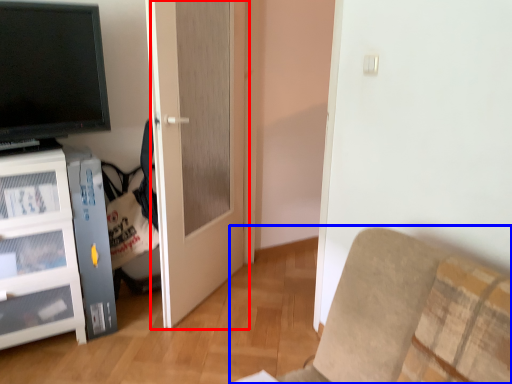
Question: Which object appears farthest to the camera in this image, door (highlighted by a red box) or furniture (highlighted by a blue box)?

Choices:
 (A) door
 (B) furniture

Answer: (A)